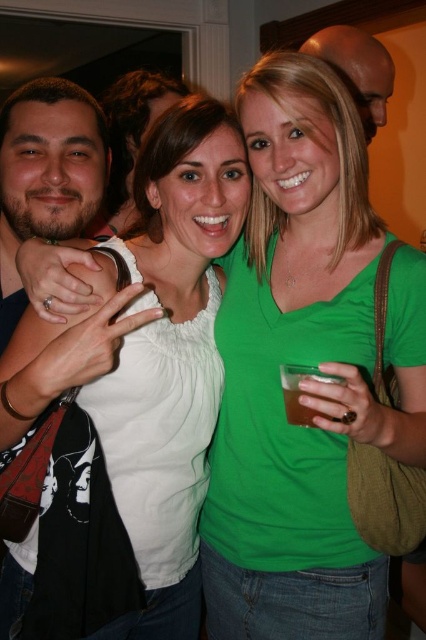
Is green matte shirt at center above white matte shirt at center?

Incorrect, green matte shirt at center is not positioned above white matte shirt at center.

You are a GUI agent. You are given a task and a screenshot of the screen. Output one action in this format:
    pyautogui.click(x=<x>, y=<y>)
    Task: Click on the green matte shirt at center
    
    Given the screenshot: What is the action you would take?
    coord(307,364)

Is point (319, 129) closer to camera compared to point (111, 477)?

Yes, point (319, 129) is closer to viewer.

This screenshot has width=426, height=640. Find the location of `green matte shirt at center`. green matte shirt at center is located at coordinates (307, 364).

Can you confirm if bald head at upper center is bigger than translucent amber liquid at hand right?

Indeed, bald head at upper center has a larger size compared to translucent amber liquid at hand right.

Can you confirm if bald head at upper center is smaller than translucent amber liquid at hand right?

No.

The image size is (426, 640). Find the location of `bald head at upper center`. bald head at upper center is located at coordinates (357, 68).

Does point (195, 628) come farther from viewer compared to point (370, 44)?

No, (195, 628) is closer to viewer.

Locate an element on the screen. The width and height of the screenshot is (426, 640). white matte shirt at center is located at coordinates [x=172, y=356].